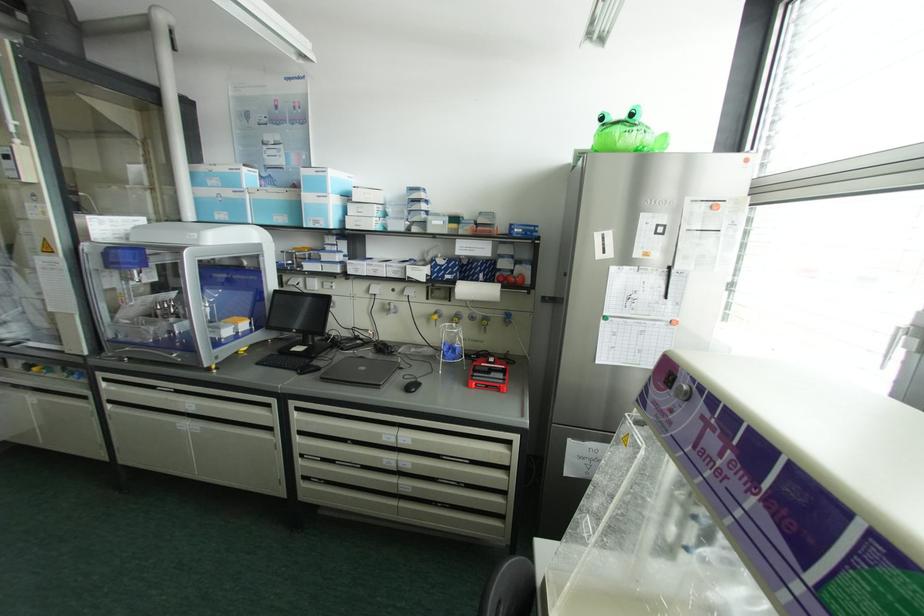
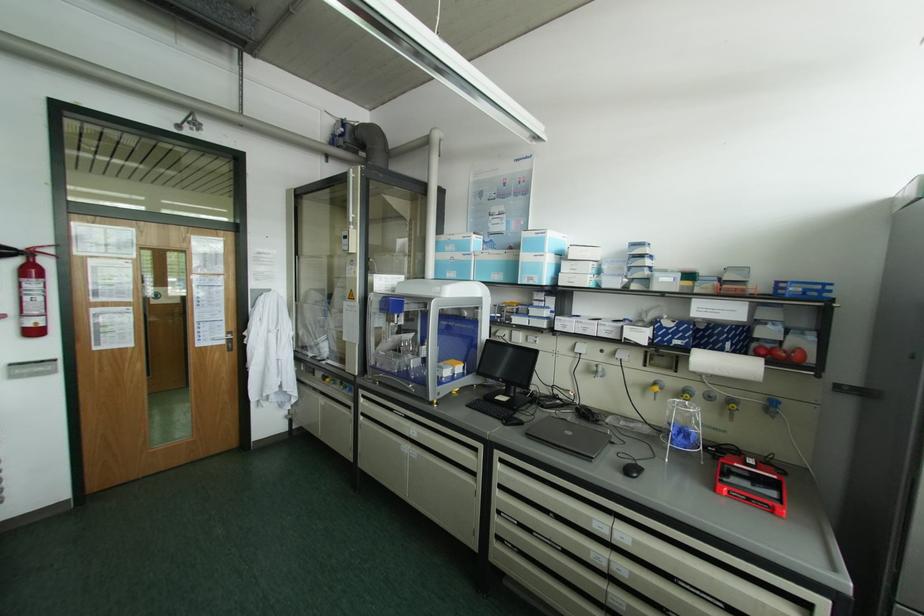
Find the pixel in the second image that matches [315,222] in the first image.

(530, 278)